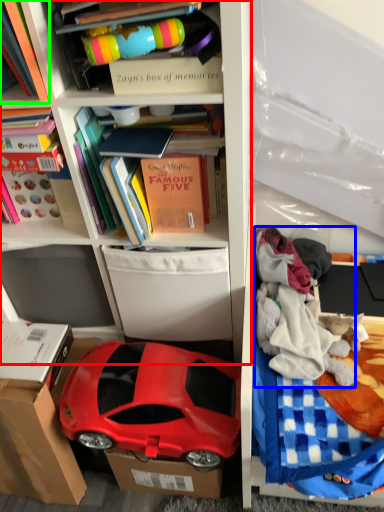
Question: Which object is the farthest from shelf (highlighted by a red box)? Choose among these: clothing (highlighted by a blue box) or book (highlighted by a green box).

Choices:
 (A) clothing
 (B) book

Answer: (B)